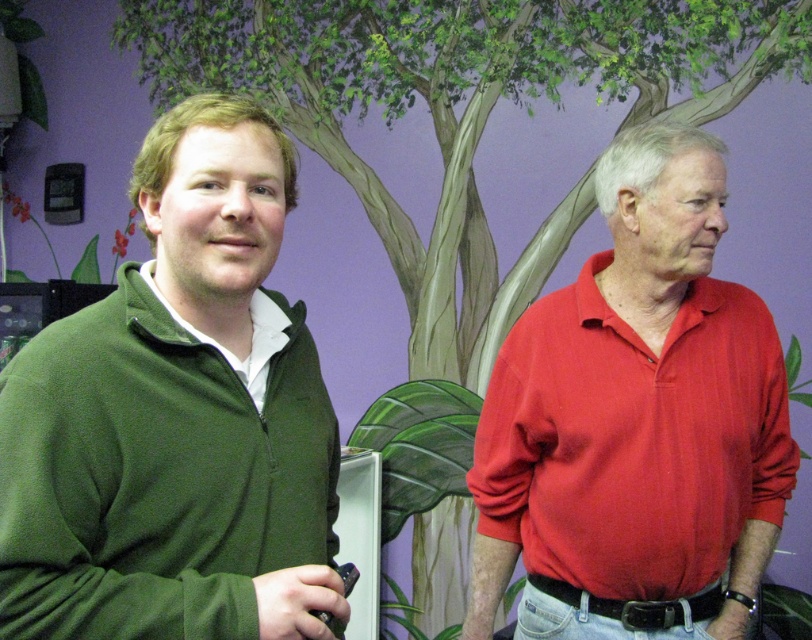
Which of these two, green fleece sweater at left or matte red shirt at right, stands taller?

matte red shirt at right is taller.

Identify the location of green fleece sweater at left. (176, 417).

This screenshot has height=640, width=812. What do you see at coordinates (176, 417) in the screenshot?
I see `green fleece sweater at left` at bounding box center [176, 417].

Where is `green fleece sweater at left`? green fleece sweater at left is located at coordinates (176, 417).

In the scene shown: Who is lower down, green fleece sweater at left or green zip-up sweater at left?

green fleece sweater at left

Who is more distant from viewer, (249, 547) or (158, 301)?

The point (158, 301) is behind.

The height and width of the screenshot is (640, 812). In order to click on green fleece sweater at left in this screenshot , I will do `click(176, 417)`.

Between point (769, 416) and point (249, 385), which one is positioned in front?

Positioned in front is point (249, 385).

Who is positioned more to the right, matte red shirt at right or green zip-up sweater at left?

Positioned to the right is matte red shirt at right.

Image resolution: width=812 pixels, height=640 pixels. In order to click on matte red shirt at right in this screenshot , I will do `click(636, 422)`.